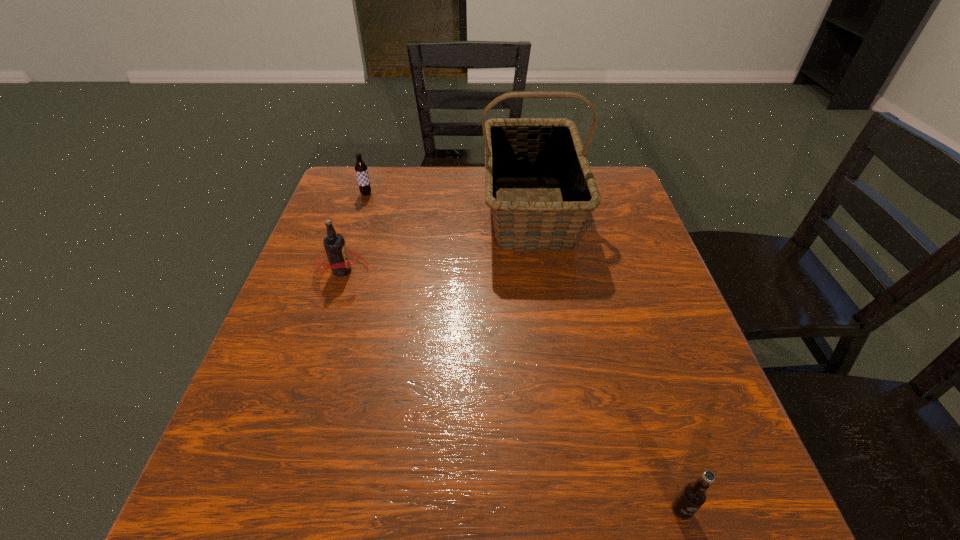
Image resolution: width=960 pixels, height=540 pixels. Find the location of `vacant space in between the basket and the nearest root beer`. vacant space in between the basket and the nearest root beer is located at coordinates (606, 360).

Locate an element on the screen. The height and width of the screenshot is (540, 960). free point between the farthest root beer and the tallest object is located at coordinates (448, 202).

Find the location of a particular element. free area in between the basket and the second nearest root beer is located at coordinates (437, 240).

Find the location of a particular element. unoccupied position between the second nearest root beer and the nearest object is located at coordinates (512, 390).

Identify which object is the second closest to the second object from right to left. Please provide its 2D coordinates. Your answer should be formatted as a tuple, i.e. [(x, y)], where the tuple contains the x and y coordinates of a point satisfying the conditions above.

[(361, 169)]

Select which object appears as the third closest to the farthest root beer. Please provide its 2D coordinates. Your answer should be formatted as a tuple, i.e. [(x, y)], where the tuple contains the x and y coordinates of a point satisfying the conditions above.

[(693, 495)]

Select which root beer is the second closest to the rightmost object. Please provide its 2D coordinates. Your answer should be formatted as a tuple, i.e. [(x, y)], where the tuple contains the x and y coordinates of a point satisfying the conditions above.

[(361, 169)]

You are a GUI agent. You are given a task and a screenshot of the screen. Output one action in this format:
    pyautogui.click(x=<x>, y=<y>)
    Task: Click on the root beer that is the second nearest to the third object from left to right
    The height and width of the screenshot is (540, 960).
    Given the screenshot: What is the action you would take?
    pyautogui.click(x=361, y=169)

Where is `free location that satisfies the following two spatial constraints: 1. by the handle of the basket; 2. on the label of the second farthest root beer`? free location that satisfies the following two spatial constraints: 1. by the handle of the basket; 2. on the label of the second farthest root beer is located at coordinates (540, 271).

The image size is (960, 540). I want to click on vacant space that satisfies the following two spatial constraints: 1. by the handle of the tallest object; 2. on the label of the second nearest root beer, so click(x=540, y=271).